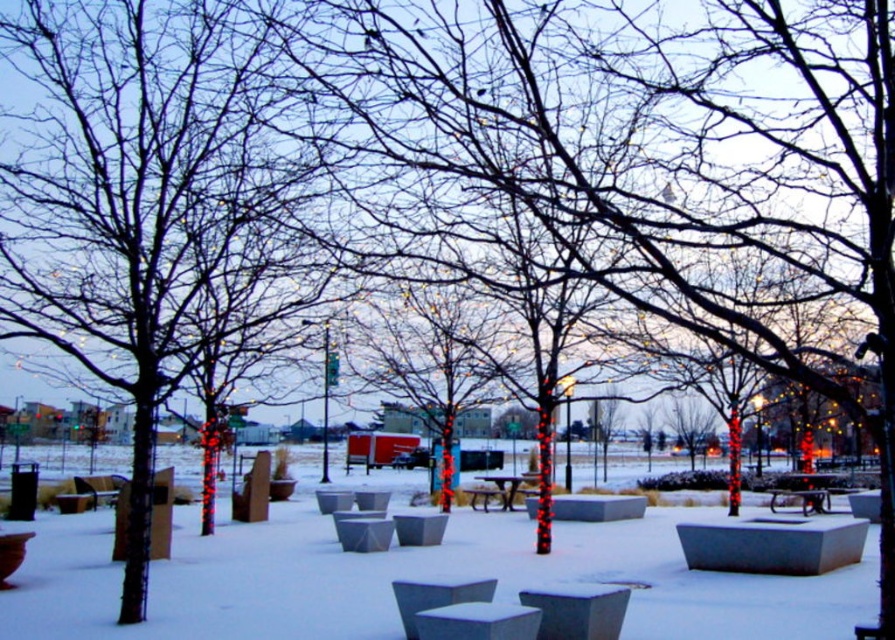
Question: Among these objects, which one is nearest to the camera?

Choices:
 (A) smooth bark tree at center
 (B) metallic silver picnic table at center

Answer: (A)

Question: Does smooth bark tree at center have a lesser width compared to metallic silver bench at center?

Choices:
 (A) yes
 (B) no

Answer: (B)

Question: Considering the real-world distances, which object is closest to the metallic silver picnic table at center?

Choices:
 (A) white matte snow at center
 (B) metallic silver bench at center

Answer: (A)

Question: Does white matte snow at center appear under metallic silver picnic table at center?

Choices:
 (A) yes
 (B) no

Answer: (B)

Question: Among these objects, which one is nearest to the camera?

Choices:
 (A) metallic silver picnic table at center
 (B) metallic silver bench at center
 (C) white matte snow at center

Answer: (C)

Question: Does smooth bark tree at center have a smaller size compared to metallic silver bench at center?

Choices:
 (A) no
 (B) yes

Answer: (A)